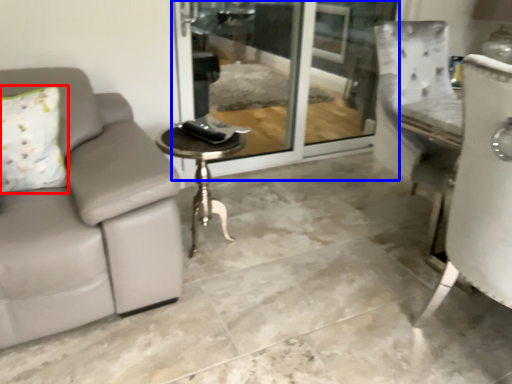
Question: Which of the following is the farthest to the observer, pillow (highlighted by a red box) or screen door (highlighted by a blue box)?

Choices:
 (A) pillow
 (B) screen door

Answer: (B)